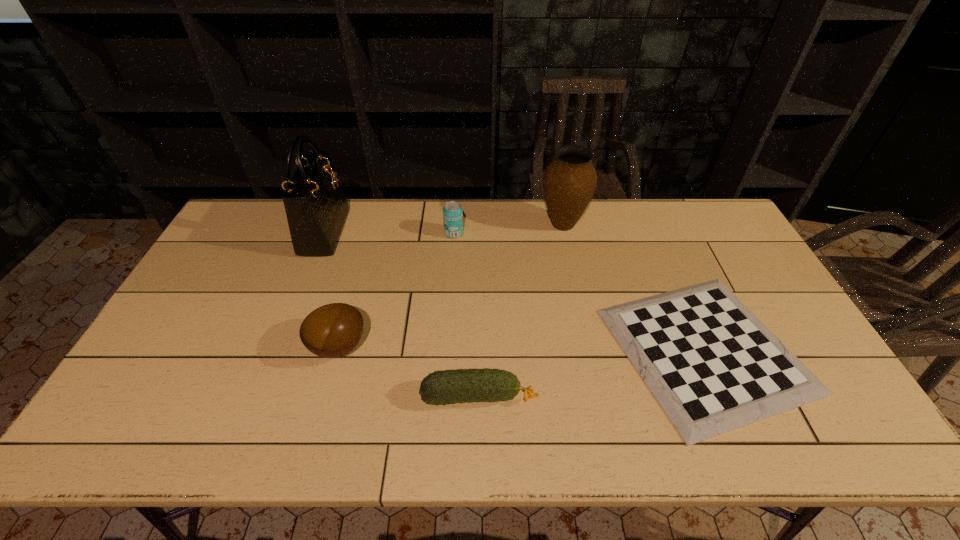
Locate an element on the screen. free space between the chessboard and the second tallest object is located at coordinates (634, 287).

I want to click on empty space that is in between the chessboard and the cucumber, so click(592, 373).

Find the location of a particular element. The image size is (960, 540). vacant area that lies between the handbag and the urn is located at coordinates (444, 228).

Where is `free spot between the shortest object and the beer can`? The width and height of the screenshot is (960, 540). free spot between the shortest object and the beer can is located at coordinates (580, 292).

Where is `unoccupied area between the second object from left to right and the cucumber`? The width and height of the screenshot is (960, 540). unoccupied area between the second object from left to right and the cucumber is located at coordinates (409, 372).

The height and width of the screenshot is (540, 960). Find the location of `the third closest object to the third tallest object`. the third closest object to the third tallest object is located at coordinates (331, 331).

Find the location of a particular element. Image resolution: width=960 pixels, height=540 pixels. object that is the fourth nearest to the second tallest object is located at coordinates (331, 331).

Find the location of `free spot that satisfies the following two spatial constraints: 1. at the front of the bowl with visible charms; 2. on the right side of the tallest object`. free spot that satisfies the following two spatial constraints: 1. at the front of the bowl with visible charms; 2. on the right side of the tallest object is located at coordinates (279, 347).

At what (x,y) coordinates should I click in order to perform the action: click on free space that satisfies the following two spatial constraints: 1. at the front of the leftmost object with visible charms; 2. on the left side of the bowl. Please return your answer as a coordinate pair (x, y). This screenshot has width=960, height=540. Looking at the image, I should click on (279, 347).

At what (x,y) coordinates should I click in order to perform the action: click on free space that satisfies the following two spatial constraints: 1. on the back side of the beer can; 2. at the front of the tallest object with visible charms. Please return your answer as a coordinate pair (x, y). Looking at the image, I should click on (454, 232).